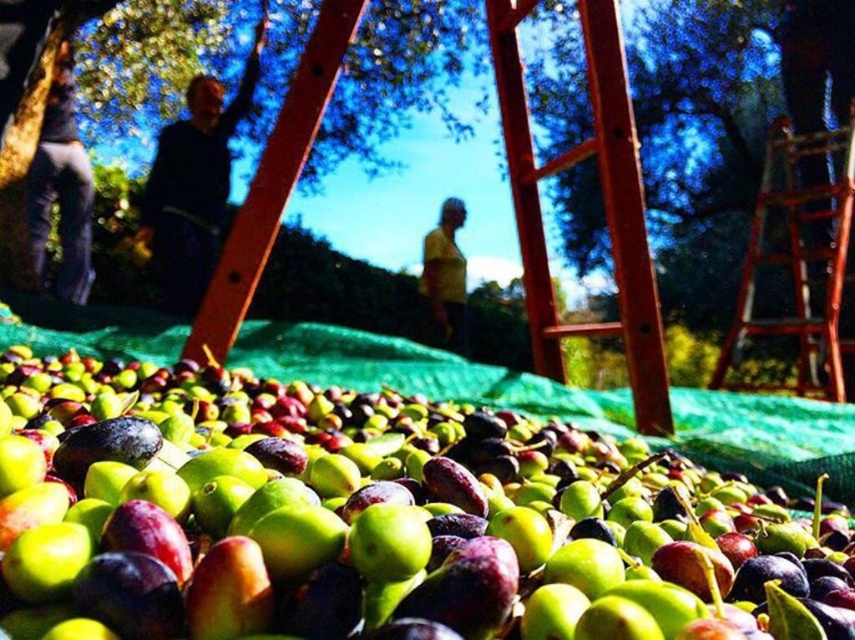
Question: Which point is farther to the camera?

Choices:
 (A) green matte olives at center
 (B) yellow matte shirt at center

Answer: (B)

Question: Which point is farther to the camera?

Choices:
 (A) (842, 147)
 (B) (429, 317)
 (C) (777, 595)
 (D) (204, 189)

Answer: (B)

Question: In this image, where is dark blue sweater at upper left located relative to yellow matte shirt at center?

Choices:
 (A) left
 (B) right

Answer: (A)

Question: Does metallic red ladder at right appear on the right side of yellow matte shirt at center?

Choices:
 (A) yes
 (B) no

Answer: (A)

Question: Which point is closer to the camera taking this photo?

Choices:
 (A) (43, 230)
 (B) (163, 179)
 (C) (752, 248)

Answer: (C)

Question: Does metallic red ladder at right have a lesser width compared to dark blue jeans at left?

Choices:
 (A) yes
 (B) no

Answer: (B)